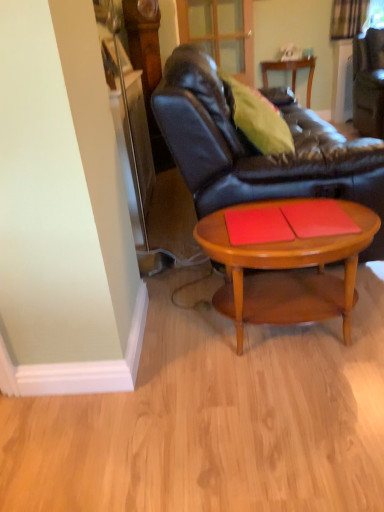
Image resolution: width=384 pixels, height=512 pixels. Find the location of `empty space that is ontop of red matte placemat at center, the first plank from the right (from a real-world perspective)`. empty space that is ontop of red matte placemat at center, the first plank from the right (from a real-world perspective) is located at coordinates (309, 217).